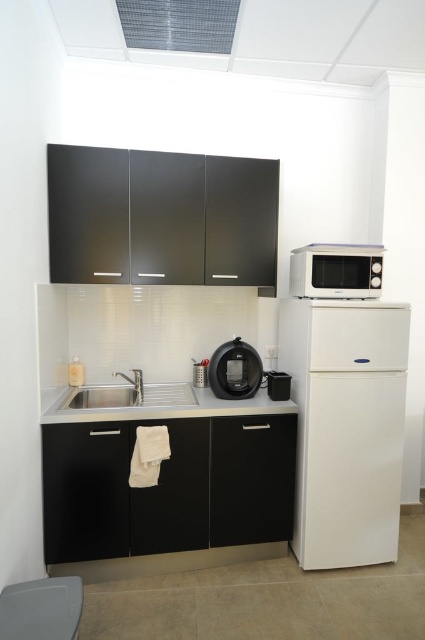
Is point (363, 48) positioned after point (283, 385)?

No.

Is white matte exhaust hood at upper center below black plastic toaster at lower center?

No, white matte exhaust hood at upper center is not below black plastic toaster at lower center.

Who is more forward, (362, 68) or (286, 392)?

Positioned in front is point (286, 392).

Where is `white matte exhaust hood at upper center`? white matte exhaust hood at upper center is located at coordinates (272, 38).

Who is shorter, white matte refrigerator at right or black plastic toaster at lower center?

black plastic toaster at lower center

Is point (323, 445) less distant than point (274, 380)?

Yes, it is.

This screenshot has width=425, height=640. I want to click on white matte refrigerator at right, so click(345, 426).

Is point (348, 330) positioned behind point (181, 413)?

Yes, point (348, 330) is behind point (181, 413).

Is white matte refrigerator at right in front of satin black counter top at center?

No, it is behind satin black counter top at center.

Locate an element on the screen. The height and width of the screenshot is (640, 425). white matte refrigerator at right is located at coordinates (345, 426).